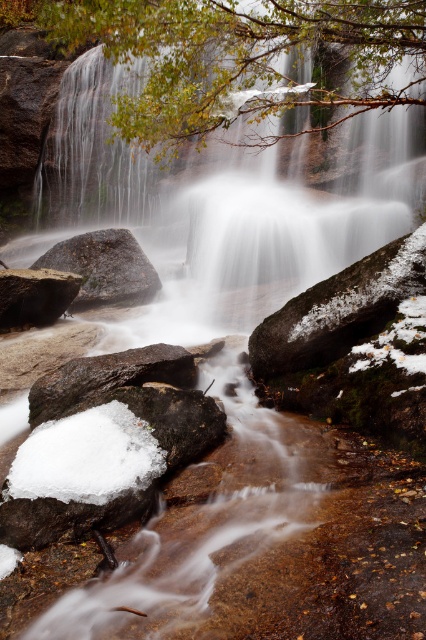
You are a hiker trying to cross the river near the waterfall. You see a snowy mossy rock at center and a matte black rock at lower left. Which rock is closer to the water surface?

The snowy mossy rock at center is below matte black rock at lower left, so it is closer to the water surface.

From the picture: You are standing at the base of the waterfall in the image. There is a snowy mossy rock located at point (339, 308). If you want to reach this rock, which direction should you move relative to your current position?

The snowy mossy rock at center is located at point (339, 308), so you should move towards the center of the scene to reach it.

You are standing at the base of the waterfall and want to take a photo of the point at coordinates point (334, 54). If your camera has a maximum focus range of 10 meters, will you be able to focus on that point?

The distance of point (334, 54) from viewer is 11.25 meters, so the camera cannot focus on it since it exceeds the maximum range of 10 meters.